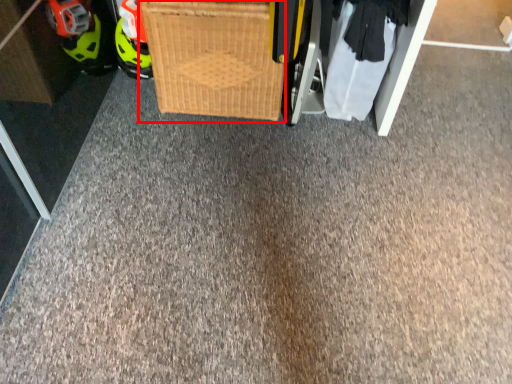
Question: From the image's perspective, what is the correct spatial relationship of basket (annotated by the red box) in relation to clothing?

Choices:
 (A) above
 (B) below

Answer: (A)